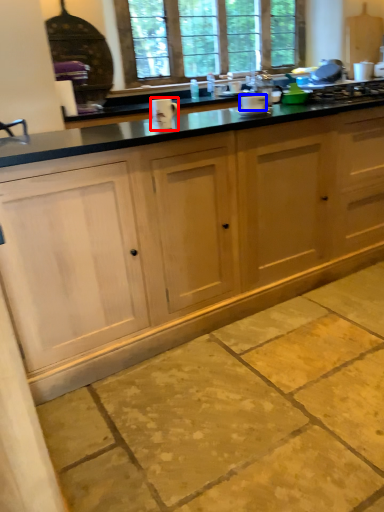
Question: Among these objects, which one is nearest to the camera, appliance (highlighted by a red box) or appliance (highlighted by a blue box)?

Choices:
 (A) appliance
 (B) appliance

Answer: (A)